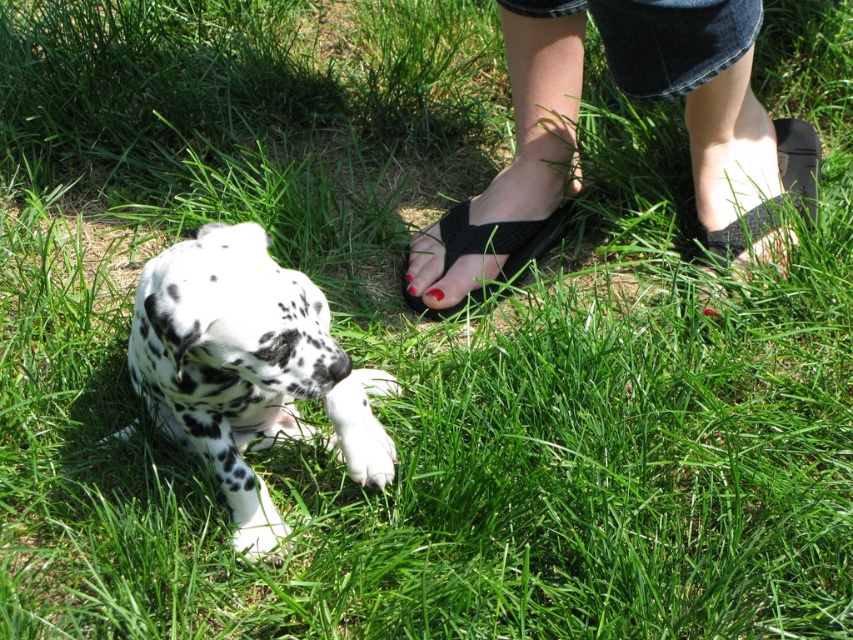
Question: Which object is the closest to the black fabric sandals at lower right?

Choices:
 (A) matte red nail polish at center
 (B) nail polish at center
 (C) black fabric sandal at lower right
 (D) black mesh sandal at center

Answer: (C)

Question: Which object appears closest to the camera in this image?

Choices:
 (A) black fabric sandal at lower right
 (B) matte red nail polish at center

Answer: (A)

Question: Where is black fabric sandal at lower right located in relation to matte red nail polish at center in the image?

Choices:
 (A) left
 (B) right

Answer: (B)

Question: Is white-spotted fur at center to the left of black mesh sandal at center from the viewer's perspective?

Choices:
 (A) no
 (B) yes

Answer: (B)

Question: Does black fabric sandals at lower right appear under black mesh sandal at center?

Choices:
 (A) no
 (B) yes

Answer: (A)

Question: Considering the real-world distances, which object is farthest from the black fabric sandals at lower right?

Choices:
 (A) matte red nail polish at center
 (B) white-spotted fur at center
 (C) nail polish at center
 (D) black mesh sandal at center

Answer: (B)